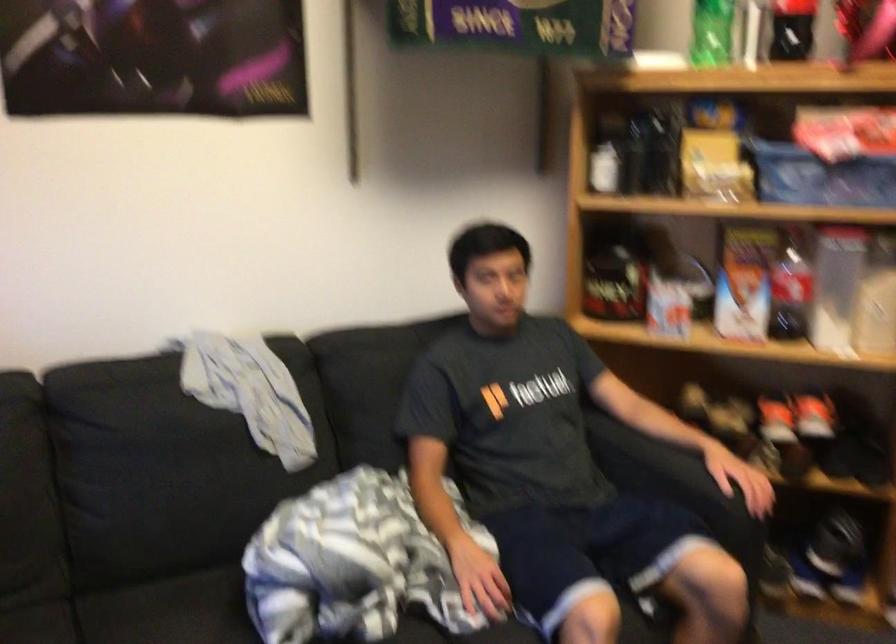
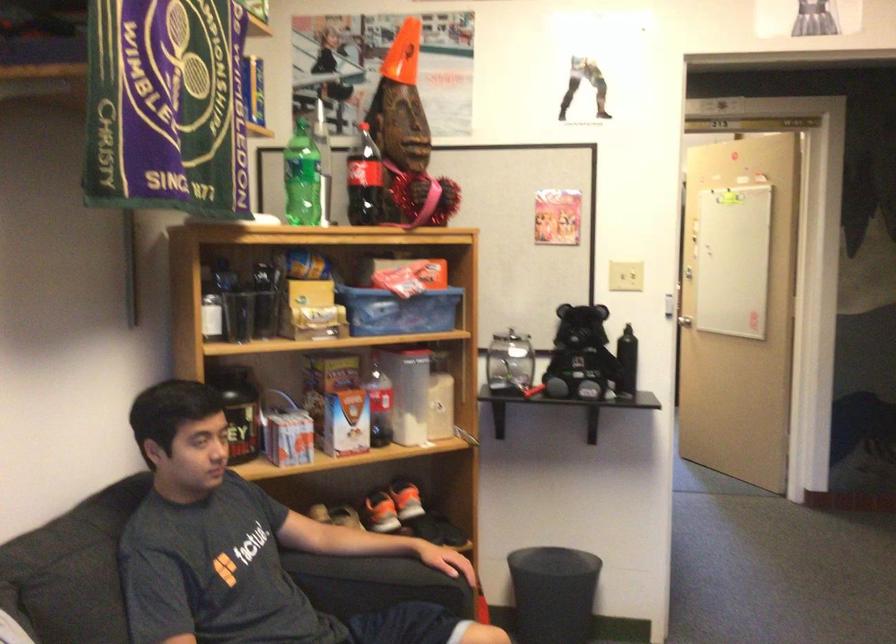
Question: Based on the continuous images, in which direction is the camera rotating? Reply with the corresponding letter.

Choices:
 (A) Left
 (B) Right
 (C) Up
 (D) Down

Answer: (B)